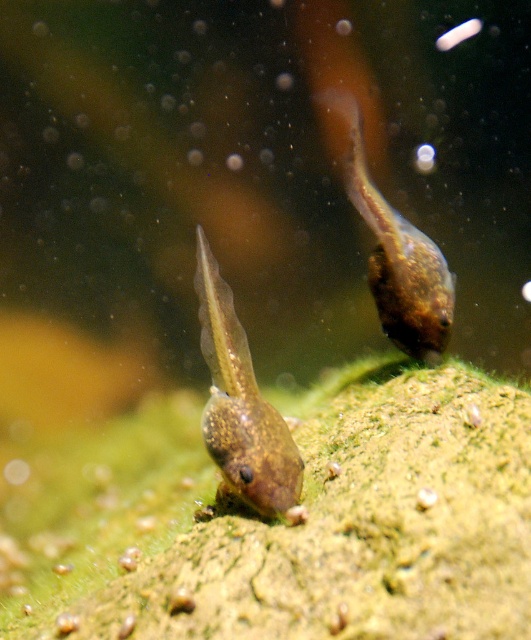
Question: Which of the following is the closest to the observer?

Choices:
 (A) translucent gelatinous tadpole at center
 (B) translucent gelatinous tadpole at upper right

Answer: (A)

Question: Which point is farther from the camera taking this photo?

Choices:
 (A) (390, 262)
 (B) (244, 385)

Answer: (A)

Question: Does translucent gelatinous tadpole at center have a smaller size compared to translucent gelatinous tadpole at upper right?

Choices:
 (A) yes
 (B) no

Answer: (A)

Question: Can you confirm if translucent gelatinous tadpole at center is positioned to the right of translucent gelatinous tadpole at upper right?

Choices:
 (A) yes
 (B) no

Answer: (B)

Question: Is translucent gelatinous tadpole at center to the left of translucent gelatinous tadpole at upper right from the viewer's perspective?

Choices:
 (A) no
 (B) yes

Answer: (B)